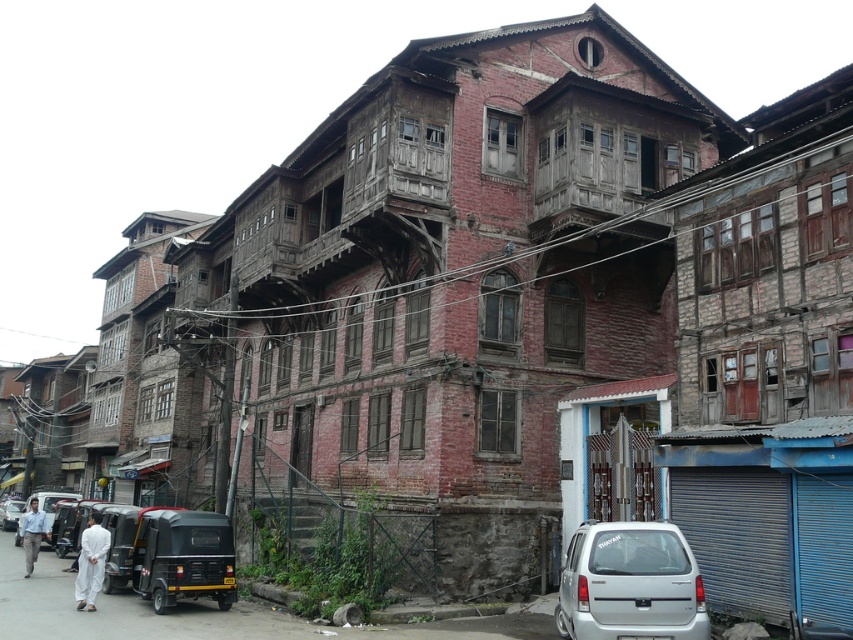
Question: Which point is closer to the camera taking this photo?

Choices:
 (A) (38, 540)
 (B) (10, 524)

Answer: (A)

Question: Which is farther from the silver metallic van at lower right?

Choices:
 (A) light blue shirt at lower left
 (B) black matte car at lower left
 (C) white cotton pants at lower left

Answer: (B)

Question: Which object is closer to the camera taking this photo?

Choices:
 (A) silver metallic van at lower right
 (B) black matte car at lower left
 (C) light blue shirt at lower left
 (D) white cotton pants at lower left

Answer: (A)

Question: In this image, where is white cotton pants at lower left located relative to light blue shirt at lower left?

Choices:
 (A) below
 (B) above

Answer: (B)

Question: Considering the relative positions of silver metallic van at lower right and white cotton pants at lower left in the image provided, where is silver metallic van at lower right located with respect to white cotton pants at lower left?

Choices:
 (A) above
 (B) below

Answer: (A)

Question: Does white cotton pants at lower left come behind light blue shirt at lower left?

Choices:
 (A) no
 (B) yes

Answer: (A)